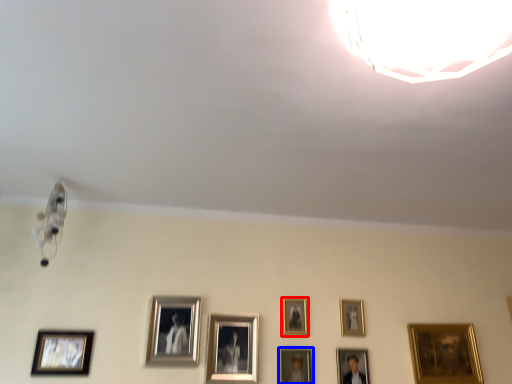
Question: Which of the following is the closest to the observer, picture frame (highlighted by a red box) or picture frame (highlighted by a blue box)?

Choices:
 (A) picture frame
 (B) picture frame

Answer: (B)